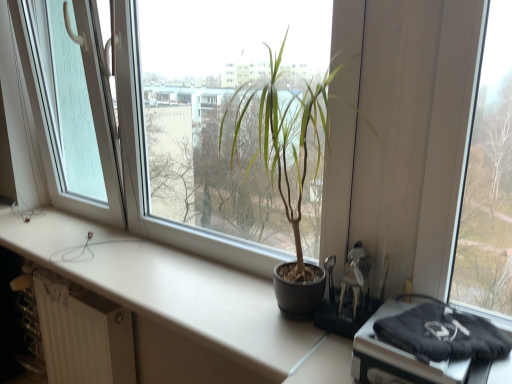
Question: Is white matte counter top at center inside the boundaries of transparent glass door at left, or outside?

Choices:
 (A) outside
 (B) inside

Answer: (A)

Question: Is white matte counter top at center in front of or behind transparent glass door at left in the image?

Choices:
 (A) front
 (B) behind

Answer: (A)

Question: Which of these objects is positioned farthest from the white textured radiator at lower left?

Choices:
 (A) white matte counter top at center
 (B) matte black pot at center
 (C) transparent glass door at left

Answer: (B)

Question: Considering the real-world distances, which object is closest to the transparent glass door at left?

Choices:
 (A) white textured radiator at lower left
 (B) white matte counter top at center
 (C) matte black pot at center

Answer: (B)